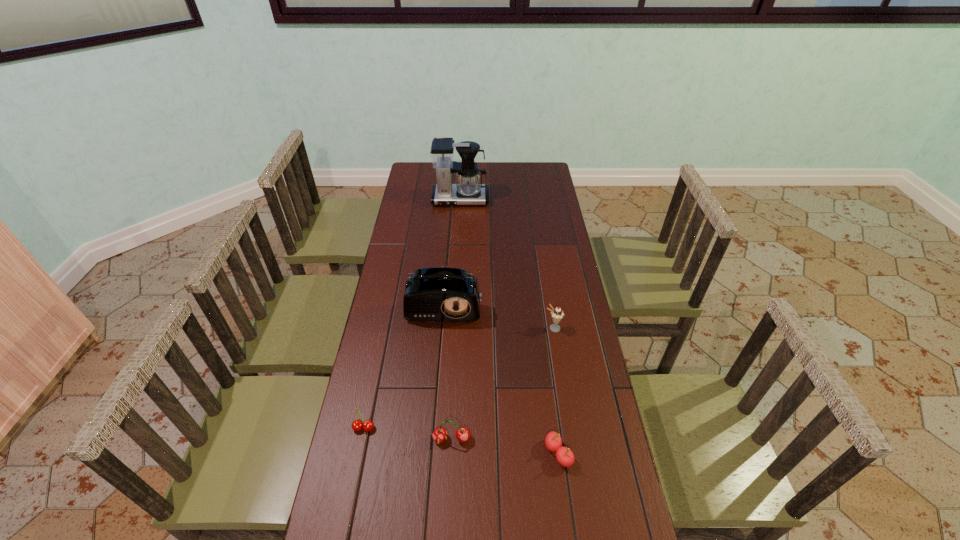
Select which object appears as the fourth closest to the coffee maker. Please provide its 2D coordinates. Your answer should be formatted as a tuple, i.e. [(x, y)], where the tuple contains the x and y coordinates of a point satisfying the conditions above.

[(440, 434)]

The width and height of the screenshot is (960, 540). Find the location of `the closest cherry relative to the icecream`. the closest cherry relative to the icecream is located at coordinates (553, 441).

Identify the location of the second closest cherry to the tallest object. This screenshot has width=960, height=540. (440, 434).

This screenshot has height=540, width=960. I want to click on free space that satisfies the following two spatial constraints: 1. with the stems of the leftmost cherry pointing upwards; 2. on the left side of the rightmost cherry, so click(359, 453).

You are a GUI agent. You are given a task and a screenshot of the screen. Output one action in this format:
    pyautogui.click(x=<x>, y=<y>)
    Task: Click on the blank area in the image that satisfies the following two spatial constraints: 1. with the stems of the leftmost object pointing upwards; 2. on the right side of the rightmost cherry
    
    Given the screenshot: What is the action you would take?
    pyautogui.click(x=359, y=453)

Identify the location of vacant position in the image that satisfies the following two spatial constraints: 1. at the front of the coffee maker where the controls are located; 2. on the right side of the rightmost cherry. [x=445, y=453].

I want to click on free space that satisfies the following two spatial constraints: 1. with the stems of the leftmost cherry pointing upwards; 2. on the left side of the rightmost cherry, so click(359, 453).

This screenshot has width=960, height=540. Find the location of `free space in the image that satisfies the following two spatial constraints: 1. at the front of the coffee maker where the controls are located; 2. on the right side of the third tallest object`. free space in the image that satisfies the following two spatial constraints: 1. at the front of the coffee maker where the controls are located; 2. on the right side of the third tallest object is located at coordinates (452, 328).